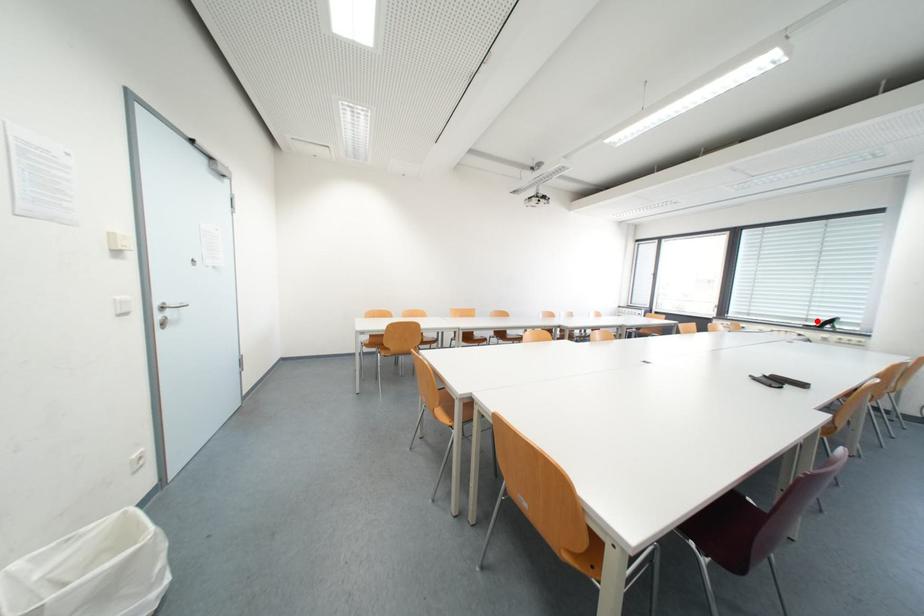
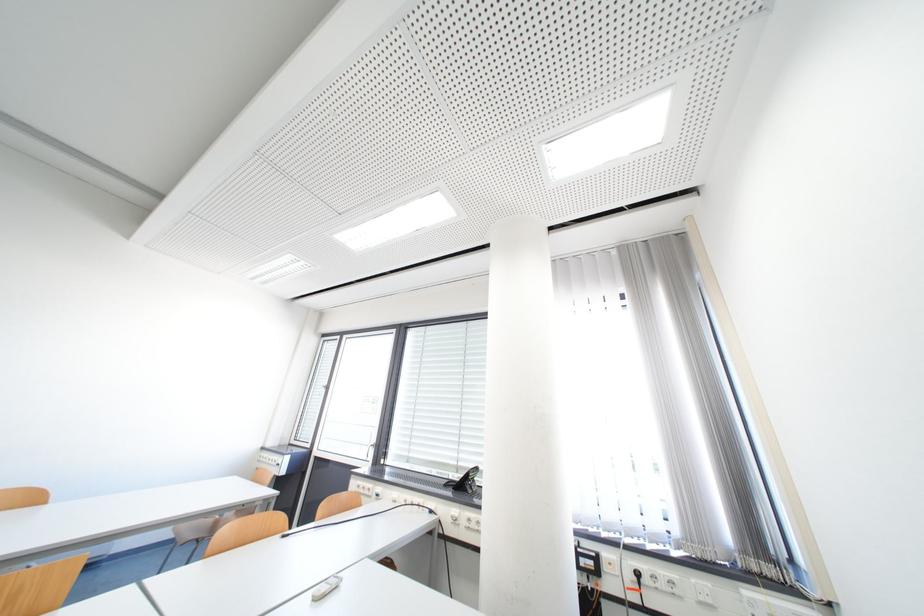
Question: I am providing you with two images of the same scene from different viewpoints. A red point is shown in image1. For the corresponding object point in image2, is it positioned nearer or farther from the camera?

Choices:
 (A) Nearer
 (B) Farther

Answer: (B)